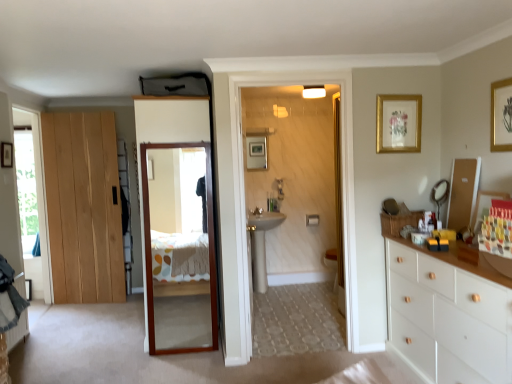
Question: From a real-world perspective, is white ceramic sink at center positioned above or below gold-framed artwork at upper right, which is counted as the 2th picture frame, starting from the back?

Choices:
 (A) below
 (B) above

Answer: (A)

Question: In terms of size, does white ceramic sink at center appear bigger or smaller than gold-framed artwork at upper right, which is counted as the second picture frame, starting from the front?

Choices:
 (A) big
 (B) small

Answer: (A)

Question: Which of these objects is positioned closest to the white ceramic sink at center?

Choices:
 (A) clear glass window at left, which is the 2th window in right-to-left order
 (B) gold-framed artwork at upper right, which is counted as the second picture frame, starting from the front
 (C) gold-framed picture at upper right, positioned as the 3th picture frame in left-to-right order
 (D) transparent glass window at left, the first window from the right
 (E) matte black mirror at right, the 2th mirror in the front-to-back sequence

Answer: (B)

Question: Which object is positioned closest to the wooden-framed mirror at right, acting as the second mirror starting from the back?

Choices:
 (A) clear glass window at left, positioned as the first window in left-to-right order
 (B) white wood chest of drawers at right
 (C) matte black mirror at right, the 2th mirror in the front-to-back sequence
 (D) white ceramic sink at center
 (E) light wood door at left, the 1th door when ordered from left to right

Answer: (C)